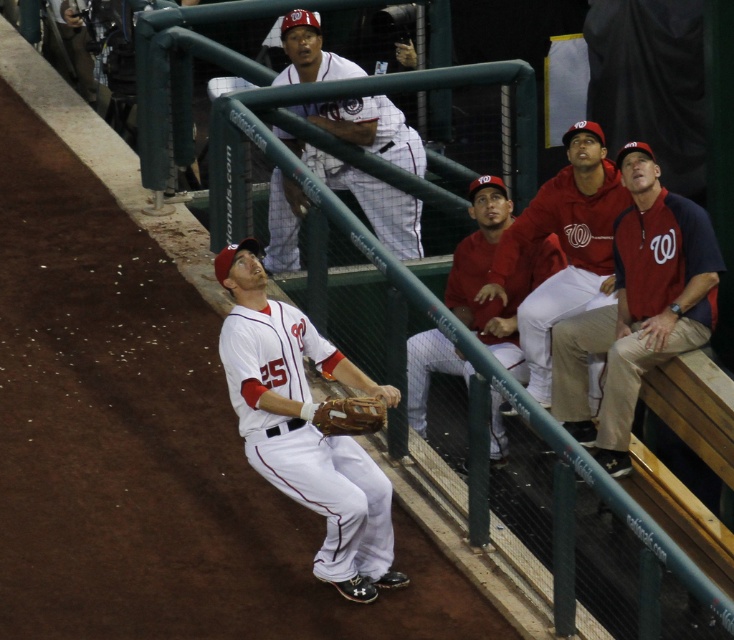
Can you confirm if white mesh uniform at upper center is positioned to the right of brown leather glove at center?

Indeed, white mesh uniform at upper center is positioned on the right side of brown leather glove at center.

Is point (283, 266) positioned behind point (345, 426)?

Yes, point (283, 266) is farther from viewer.

Is point (338, 120) behind point (374, 419)?

Yes, it is.

Where is `white mesh uniform at upper center`? The width and height of the screenshot is (734, 640). white mesh uniform at upper center is located at coordinates (367, 196).

Which is below, green metal rail at upper center or white mesh uniform at upper center?

Positioned lower is green metal rail at upper center.

Is point (730, 413) less distant than point (291, 16)?

Yes, it is in front of point (291, 16).

Describe the element at coordinates (446, 310) in the screenshot. I see `green metal rail at upper center` at that location.

This screenshot has height=640, width=734. Find the location of `green metal rail at upper center`. green metal rail at upper center is located at coordinates (446, 310).

Is matte red jersey at center above brown leather glove at center?

Indeed, matte red jersey at center is positioned over brown leather glove at center.

How far apart are matte red jersey at center and brown leather glove at center?

A distance of 2.12 meters exists between matte red jersey at center and brown leather glove at center.

Does point (539, 243) come farther from viewer compared to point (355, 410)?

Yes.

This screenshot has width=734, height=640. What are the coordinates of `matte red jersey at center` in the screenshot? It's located at (487, 269).